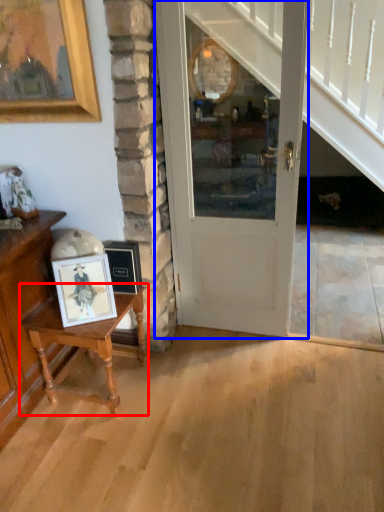
Question: Which point is closer to the camera, table (highlighted by a red box) or door (highlighted by a blue box)?

Choices:
 (A) table
 (B) door

Answer: (B)